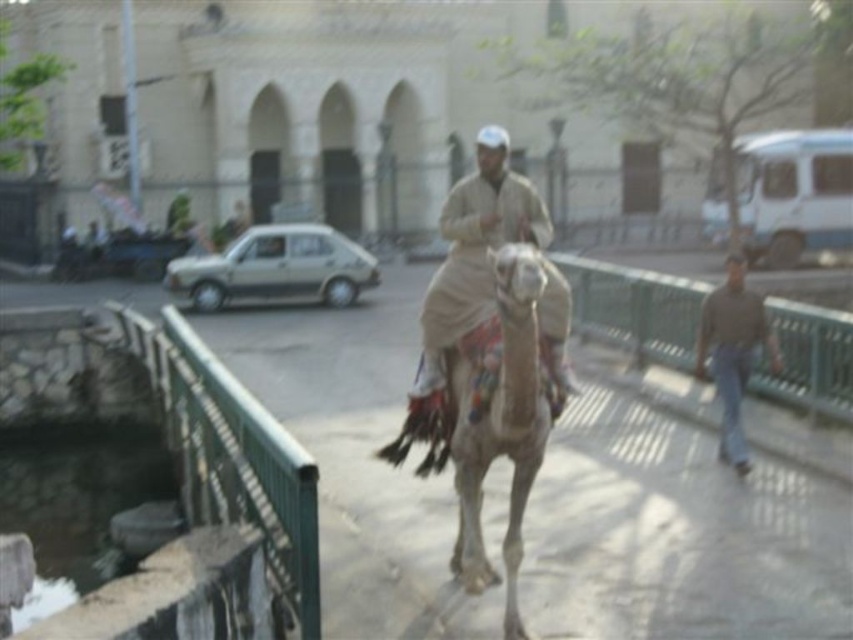
Can you confirm if white textured camel at center is positioned to the right of brown cotton shirt at right?

No, white textured camel at center is not to the right of brown cotton shirt at right.

Is white textured camel at center further to the viewer compared to brown cotton shirt at right?

No, it is in front of brown cotton shirt at right.

Which is behind, point (531, 348) or point (740, 388)?

The point (740, 388) is more distant.

The width and height of the screenshot is (853, 640). What are the coordinates of `white textured camel at center` in the screenshot? It's located at (491, 419).

Does green metal railing at lower left have a lesser width compared to white textured camel at center?

No, green metal railing at lower left is not thinner than white textured camel at center.

Does point (187, 524) come farther from viewer compared to point (459, 410)?

That is True.

Image resolution: width=853 pixels, height=640 pixels. In order to click on green metal railing at lower left in this screenshot , I will do `click(231, 456)`.

Between point (496, 259) and point (555, 292), which one is positioned in front?

Positioned in front is point (496, 259).

Between white textured camel at center and beige fabric outfit at center, which one is positioned lower?

white textured camel at center is below.

Does point (479, 552) lie behind point (445, 230)?

That is False.

You are a GUI agent. You are given a task and a screenshot of the screen. Output one action in this format:
    pyautogui.click(x=<x>, y=<y>)
    Task: Click on the white textured camel at center
    
    Given the screenshot: What is the action you would take?
    pyautogui.click(x=491, y=419)